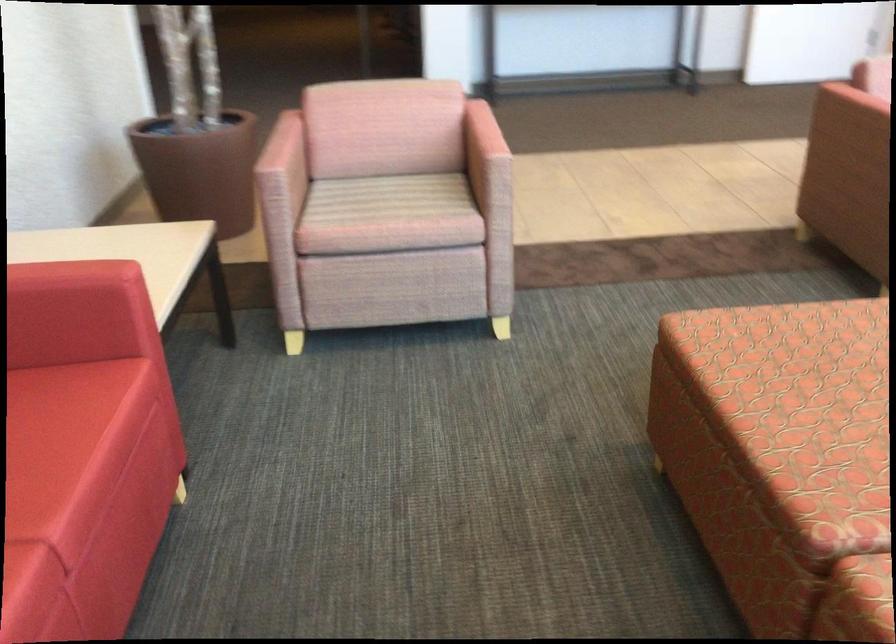
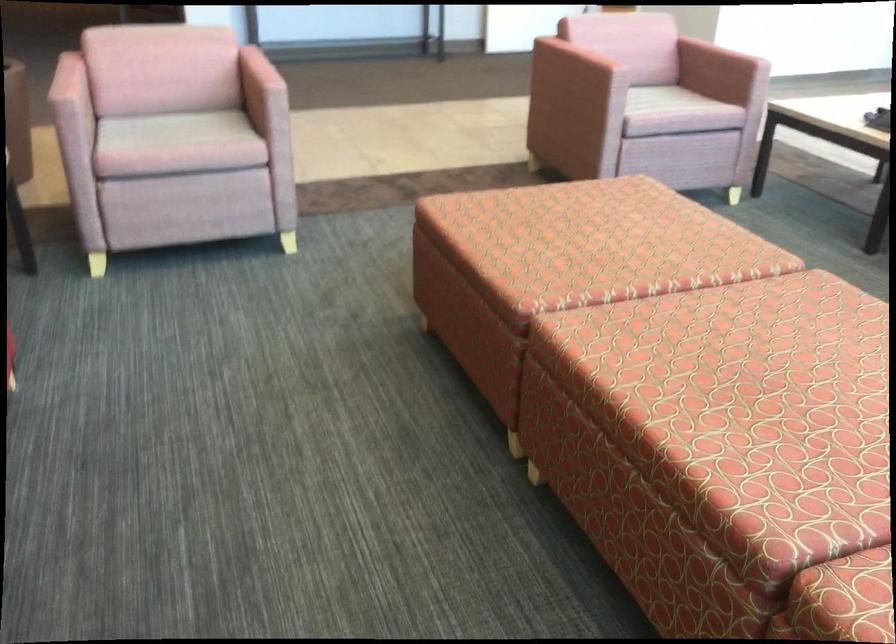
Question: Based on the continuous images, in which direction is the camera rotating? Reply with the corresponding letter.

Choices:
 (A) Left
 (B) Right
 (C) Up
 (D) Down

Answer: (B)